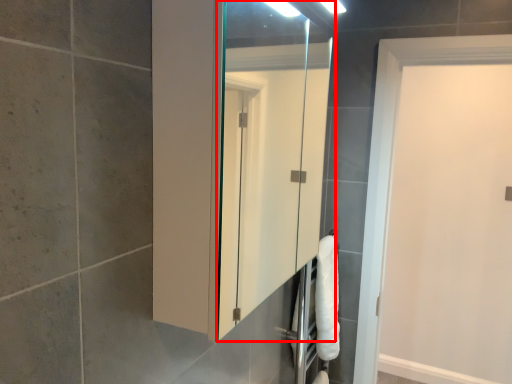
Question: From the image's perspective, where is mirror (annotated by the red box) located relative to door?

Choices:
 (A) above
 (B) below

Answer: (A)